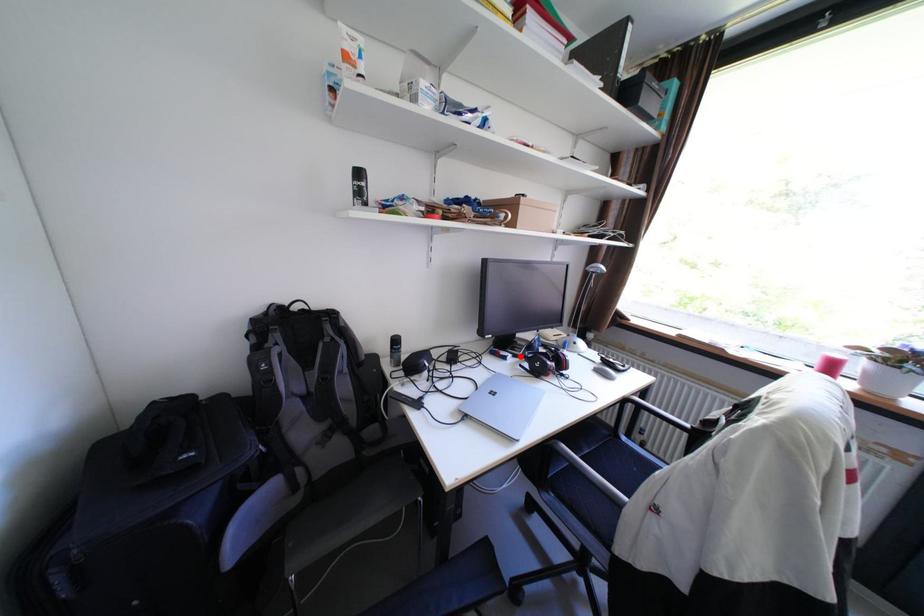
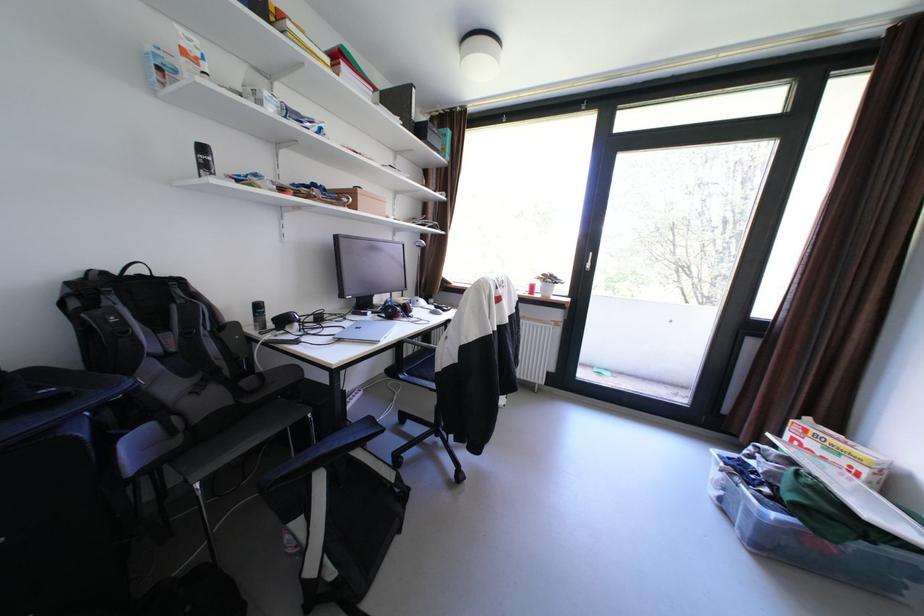
Locate, in the second image, the point that corresponds to the highlighted location in the first image.

(380, 313)